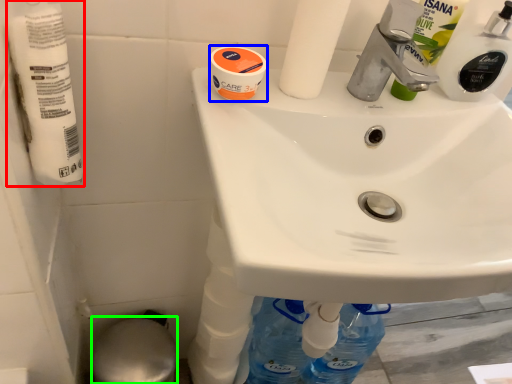
Question: Which object is the closest to the toilet paper (highlighted by a red box)? Choose among these: mouthwash (highlighted by a blue box) or bidet (highlighted by a green box).

Choices:
 (A) mouthwash
 (B) bidet

Answer: (A)